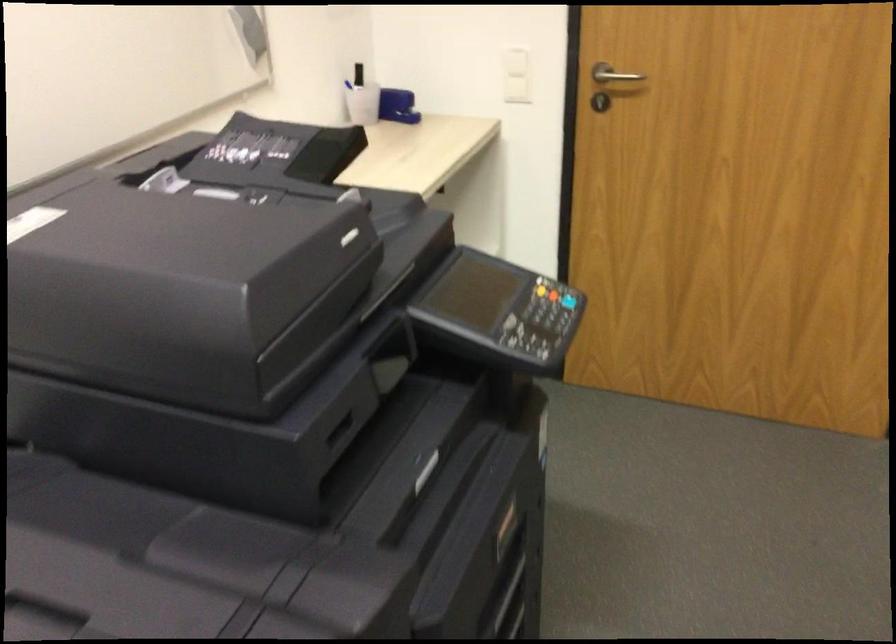
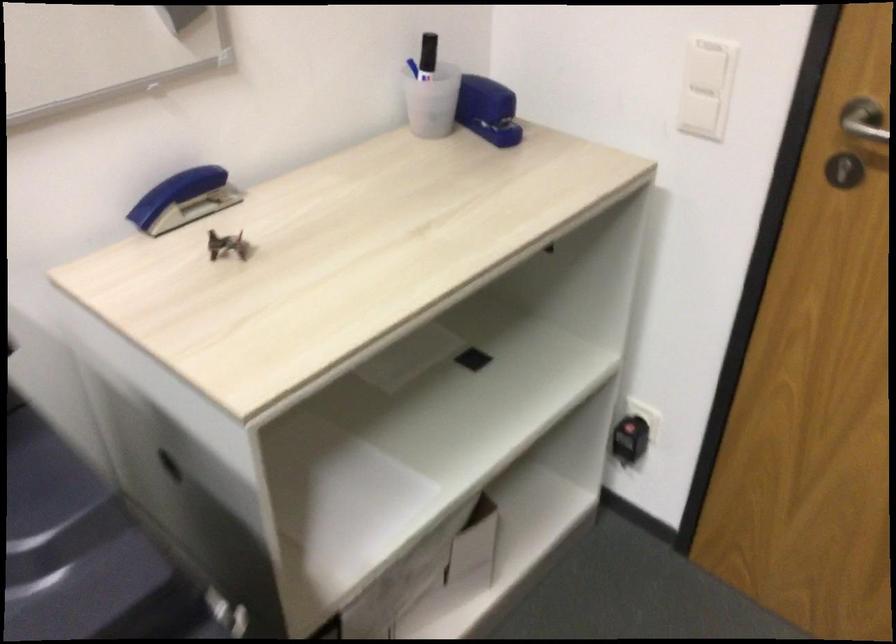
Where in the second image is the point corresponding to (x=403, y=102) from the first image?

(487, 109)